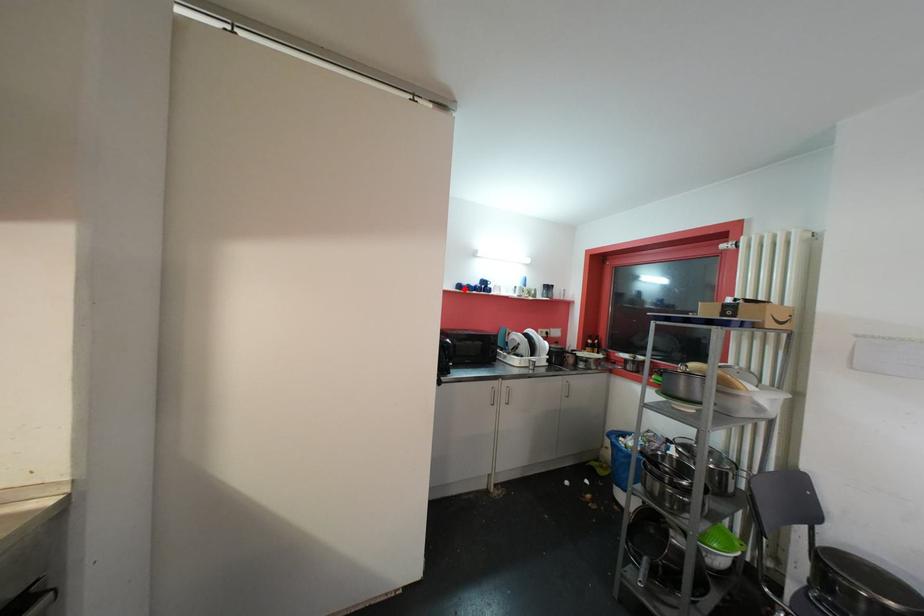
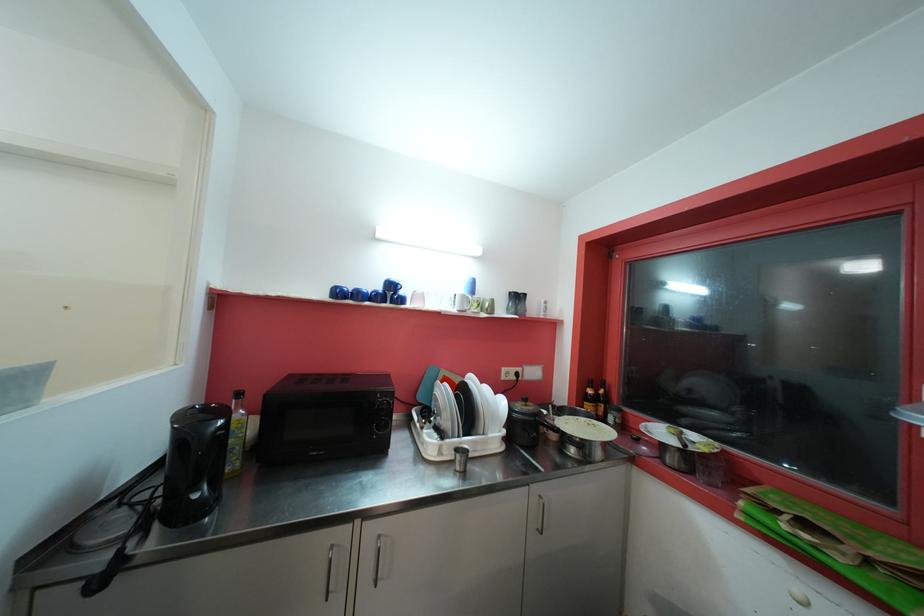
Find the pixel in the second image that matches the highlighted location in the first image.

(343, 294)